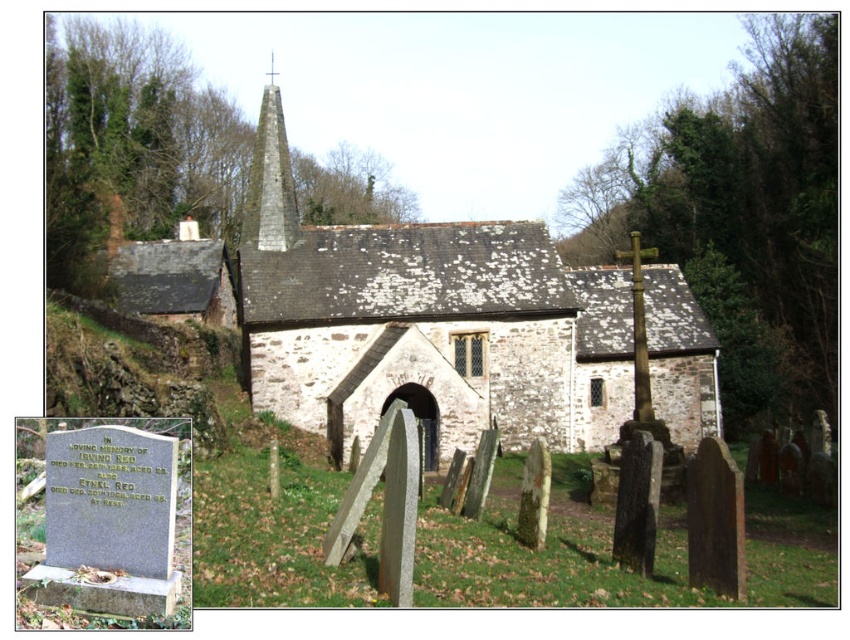
Question: Is stone church at center positioned before smooth stone spire at center?

Choices:
 (A) no
 (B) yes

Answer: (B)

Question: Among these points, which one is nearest to the camera?

Choices:
 (A) (251, 237)
 (B) (531, 294)

Answer: (B)

Question: Is stone church at center smaller than smooth stone spire at center?

Choices:
 (A) yes
 (B) no

Answer: (A)

Question: Can you confirm if stone church at center is positioned below smooth stone spire at center?

Choices:
 (A) no
 (B) yes

Answer: (B)